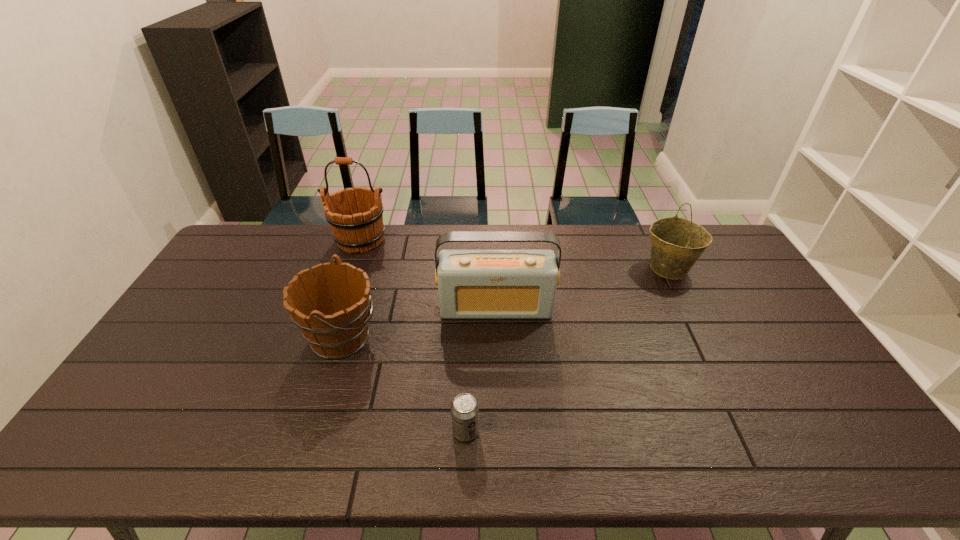
You are a GUI agent. You are given a task and a screenshot of the screen. Output one action in this format:
    pyautogui.click(x=<x>, y=<y>)
    Task: Click on the vacant space located with the handle on the fourth tallest object
    The width and height of the screenshot is (960, 540).
    Given the screenshot: What is the action you would take?
    pyautogui.click(x=411, y=338)

At what (x,y) coordinates should I click in order to perform the action: click on vacant area located 0.090m on the back of the nearest object. Please return your answer as a coordinate pair (x, y). Looking at the image, I should click on (467, 389).

At what (x,y) coordinates should I click in order to perform the action: click on object at the near edge. Please return your answer as a coordinate pair (x, y). The image size is (960, 540). Looking at the image, I should click on (464, 409).

Where is `free space at the far edge of the desktop`? free space at the far edge of the desktop is located at coordinates (599, 262).

Where is `vacant space at the near edge`? The image size is (960, 540). vacant space at the near edge is located at coordinates (397, 440).

Locate an element on the screen. vacant space at the left edge of the desktop is located at coordinates (241, 273).

Where is `free space at the far left corner`? free space at the far left corner is located at coordinates (267, 251).

Where is `vacant space at the near left corner of the desktop`? Image resolution: width=960 pixels, height=540 pixels. vacant space at the near left corner of the desktop is located at coordinates (125, 436).

Find the location of a particular element. This screenshot has width=960, height=540. free space at the near right corner is located at coordinates (889, 467).

Where is `free spot between the rightmost object and the radio receiver`? This screenshot has width=960, height=540. free spot between the rightmost object and the radio receiver is located at coordinates (582, 288).